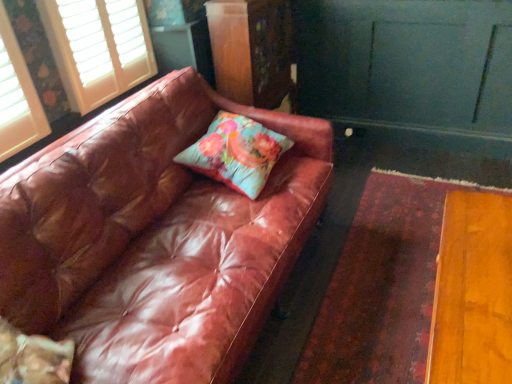
Question: Is white wood blinds at upper left in front of wooden dresser at center?

Choices:
 (A) no
 (B) yes

Answer: (B)

Question: Is white wood blinds at upper left wider than wooden dresser at center?

Choices:
 (A) no
 (B) yes

Answer: (A)

Question: Is white wood blinds at upper left shorter than wooden dresser at center?

Choices:
 (A) no
 (B) yes

Answer: (B)

Question: From a real-world perspective, is white wood blinds at upper left on top of wooden dresser at center?

Choices:
 (A) no
 (B) yes

Answer: (B)

Question: Does white wood blinds at upper left turn towards wooden dresser at center?

Choices:
 (A) yes
 (B) no

Answer: (B)

Question: Is white wood blinds at upper left bigger than wooden dresser at center?

Choices:
 (A) no
 (B) yes

Answer: (A)

Question: Is wooden dresser at center facing towards leather couch at left?

Choices:
 (A) yes
 (B) no

Answer: (B)

Question: Does wooden dresser at center have a larger size compared to leather couch at left?

Choices:
 (A) no
 (B) yes

Answer: (A)

Question: From the image's perspective, does wooden dresser at center appear higher than leather couch at left?

Choices:
 (A) yes
 (B) no

Answer: (A)

Question: Can you confirm if wooden dresser at center is thinner than leather couch at left?

Choices:
 (A) no
 (B) yes

Answer: (B)

Question: Is wooden dresser at center with leather couch at left?

Choices:
 (A) yes
 (B) no

Answer: (B)

Question: Is wooden dresser at center shorter than leather couch at left?

Choices:
 (A) yes
 (B) no

Answer: (B)

Question: Is leather couch at left far away from white wood blinds at upper left?

Choices:
 (A) yes
 (B) no

Answer: (B)